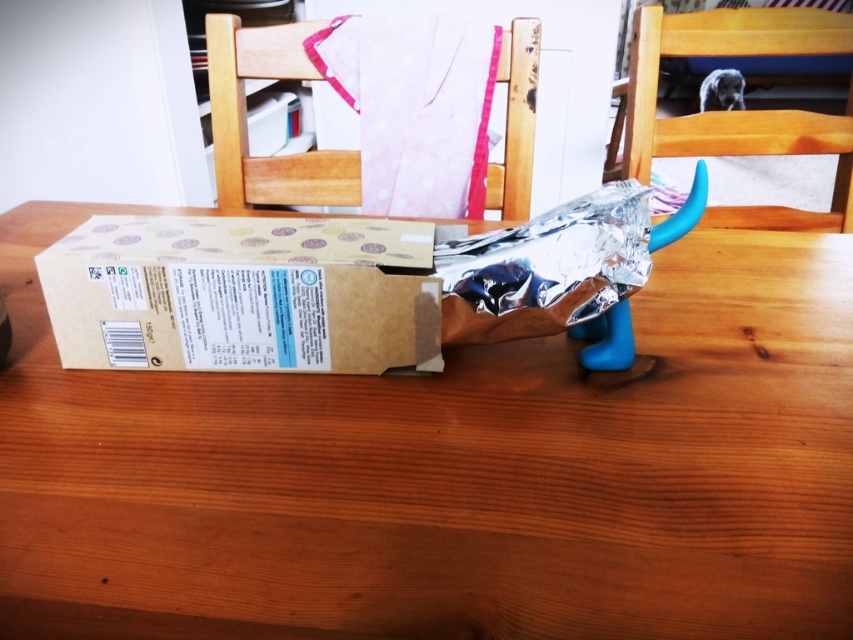
Question: Which object is positioned closest to the wooden chair at upper right?

Choices:
 (A) brown cardboard box at center
 (B) wooden table at center
 (C) pink fabric at upper center

Answer: (C)

Question: Which object is the closest to the wooden table at center?

Choices:
 (A) pink fabric at upper center
 (B) brown cardboard box at center
 (C) wooden chair at upper right

Answer: (B)

Question: Is wooden table at center thinner than pink fabric at upper center?

Choices:
 (A) yes
 (B) no

Answer: (B)

Question: Does wooden chair at upper right lie behind pink fabric at upper center?

Choices:
 (A) no
 (B) yes

Answer: (B)

Question: Which point appears closest to the camera in this image?

Choices:
 (A) (845, 198)
 (B) (480, 390)
 (C) (358, 186)

Answer: (B)

Question: Can you confirm if wooden table at center is positioned to the left of wooden chair at upper right?

Choices:
 (A) no
 (B) yes

Answer: (B)